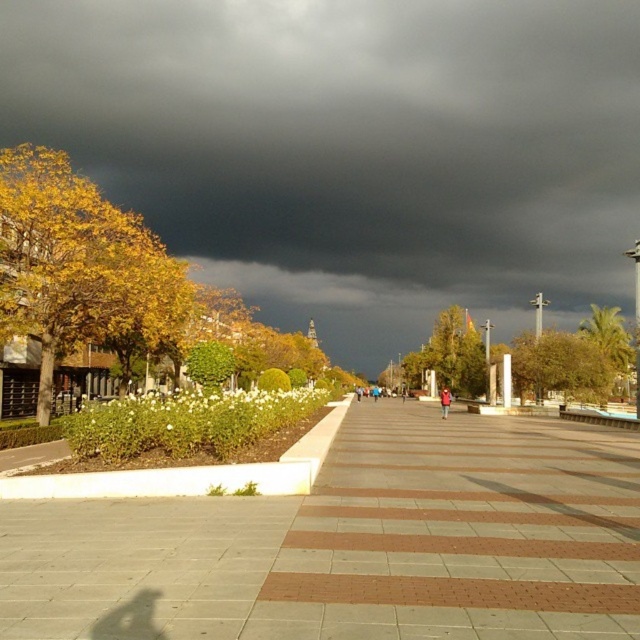
Question: Is dark gray cloud at upper center wider than brown tiled pavement at center?

Choices:
 (A) no
 (B) yes

Answer: (B)

Question: Does dark gray cloud at upper center lie behind brown tiled pavement at center?

Choices:
 (A) no
 (B) yes

Answer: (B)

Question: Does dark gray cloud at upper center appear over brown tiled pavement at center?

Choices:
 (A) no
 (B) yes

Answer: (B)

Question: Which point is farther to the camera?

Choices:
 (A) dark gray cloud at upper center
 (B) brown tiled pavement at center

Answer: (A)

Question: Which of the following is the farthest from the observer?

Choices:
 (A) brown tiled pavement at center
 (B) dark gray cloud at upper center

Answer: (B)